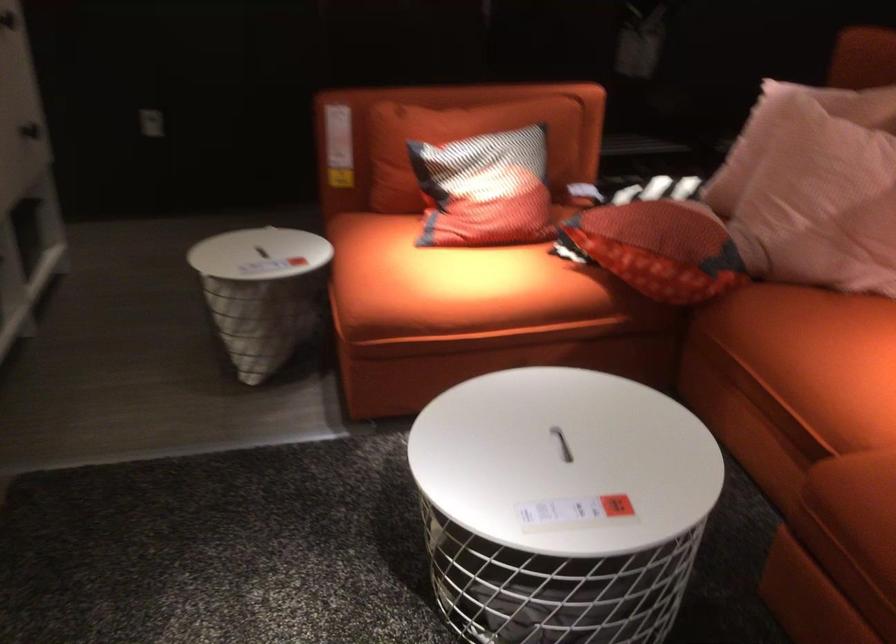
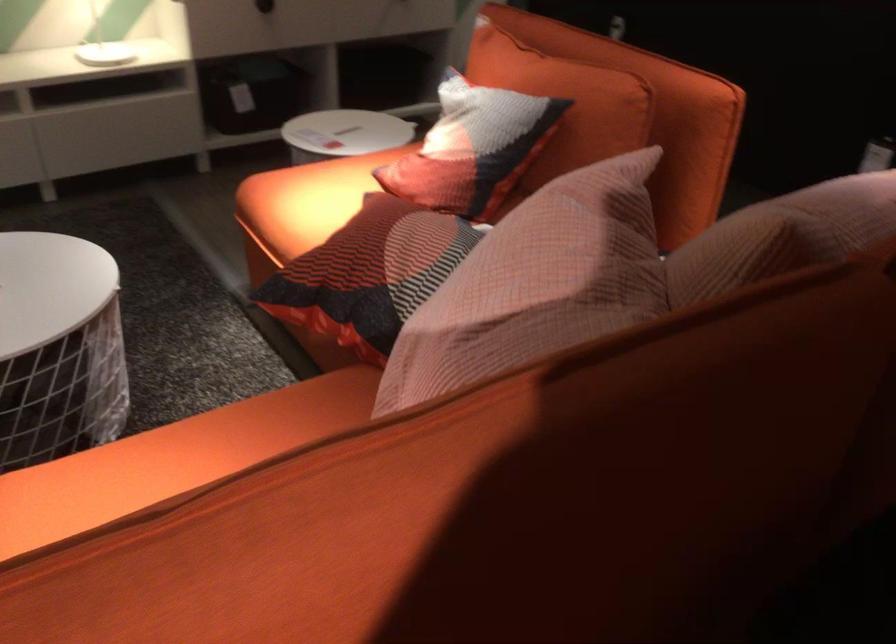
Find the pixel in the second image that matches pixel 533 172 in the first image.

(472, 147)